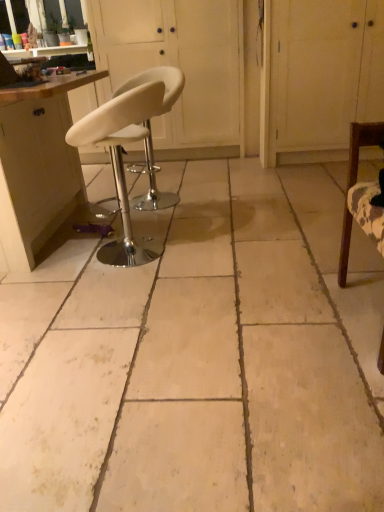
Identify the location of free spot below white leather stool at center, the 2th chair when ordered from front to back (from a real-world perspective). The image size is (384, 512). (147, 249).